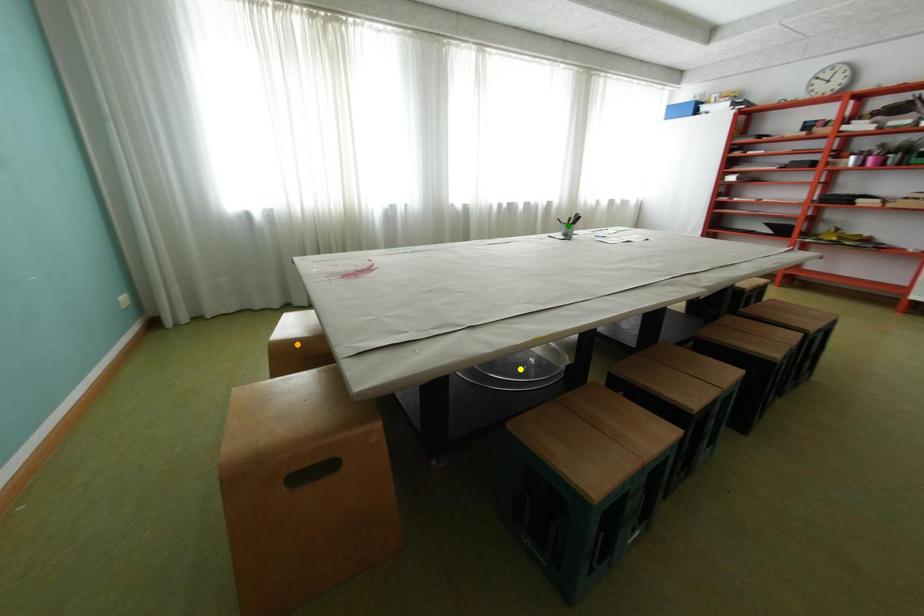
Order these from nearest to farthest:
A) green point
B) yellow point
C) orange point

green point → yellow point → orange point